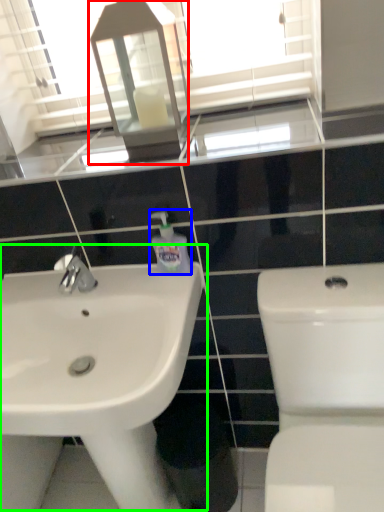
Question: Which object is positioned farthest from medicine cabinet (highlighted by a red box)? Select from cleaning product (highlighted by a blue box) and sink (highlighted by a green box).

Choices:
 (A) cleaning product
 (B) sink

Answer: (B)